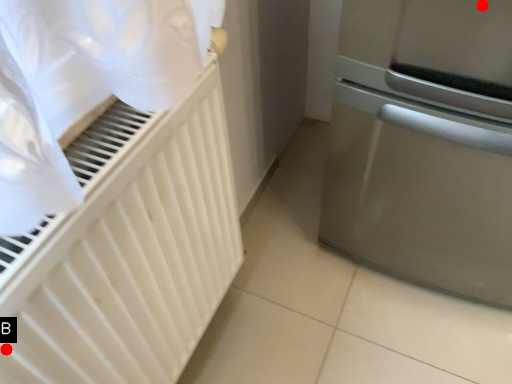
Question: Two points are circled on the image, labeled by A and B beside each circle. Which point is closer to the camera?

Choices:
 (A) A is closer
 (B) B is closer

Answer: (B)